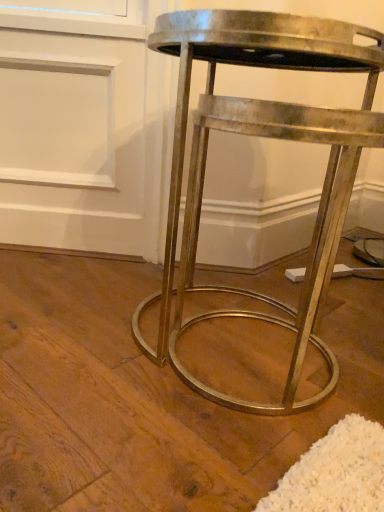
The image size is (384, 512). Identify the location of shiny metallic stool at center. (266, 137).

Describe the element at coordinates (266, 137) in the screenshot. I see `shiny metallic stool at center` at that location.

This screenshot has height=512, width=384. What are the coordinates of `shiny metallic stool at center` in the screenshot? It's located at (266, 137).